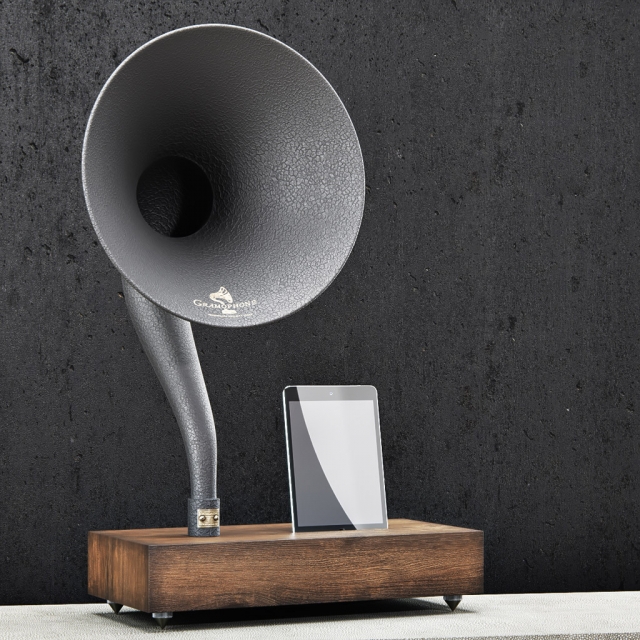
Find the location of a particular element. Image resolution: width=640 pixels, height=640 pixels. dark gray wall is located at coordinates (456, 281).